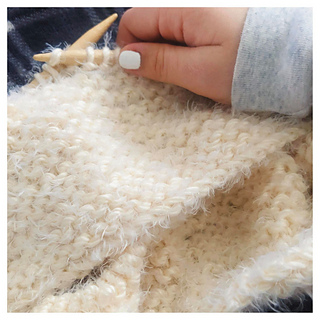
Locate an element on the screen. The image size is (320, 320). blanket is located at coordinates (50, 41).